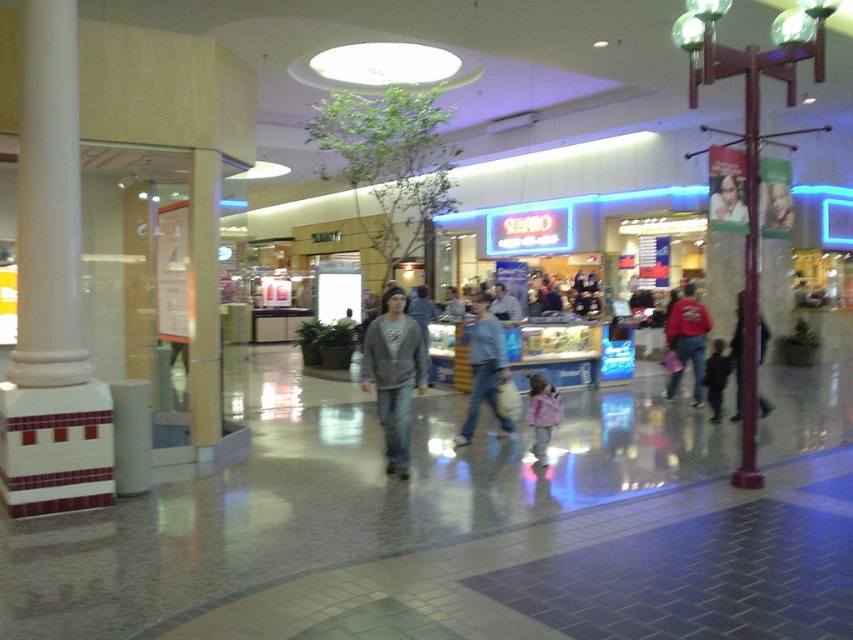
You are a customer in the mall and you want to take a photo of the smooth plastic face at center and dark blue jeans at center. Which one should you focus on first if you want to capture both in one shot?

You should focus on the smooth plastic face at center first because it is closer to the camera than the dark blue jeans at center.